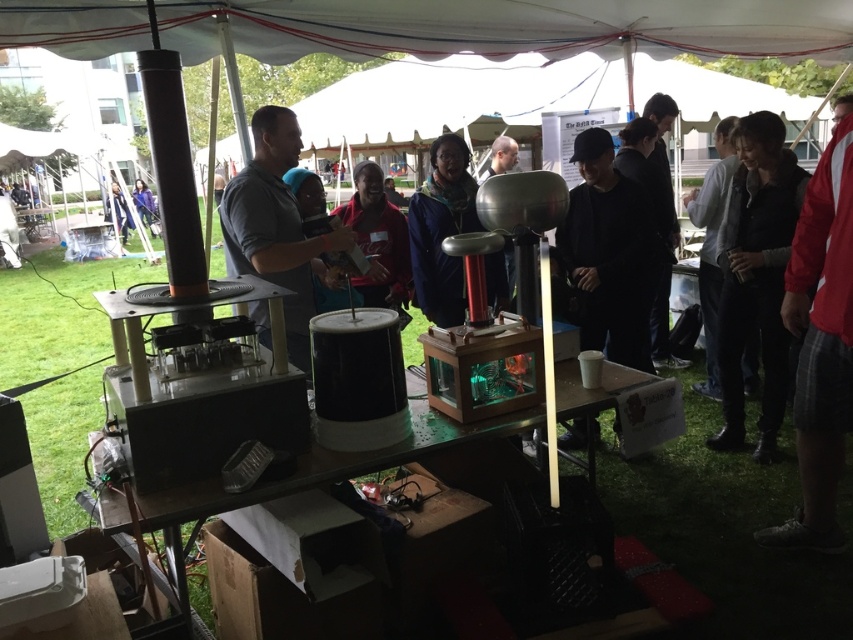
Is point (781, 250) closer to camera compared to point (376, 241)?

Yes, it is.

Image resolution: width=853 pixels, height=640 pixels. Identify the location of black leather jacket at right. (756, 276).

Is point (755, 301) more distant than point (370, 250)?

No, it is not.

Find the location of a particular element. This screenshot has width=853, height=640. black leather jacket at right is located at coordinates (756, 276).

Between gray matte shirt at center and light gray sweater at center, which one is positioned lower?

gray matte shirt at center is below.

Looking at this image, does gray matte shirt at center have a smaller size compared to light gray sweater at center?

Correct, gray matte shirt at center occupies less space than light gray sweater at center.

Between point (242, 225) and point (717, 186), which one is positioned in front?

Positioned in front is point (242, 225).

Identify the location of gray matte shirt at center. The image size is (853, 640). (276, 227).

Which is behind, point (566, 384) or point (142, 180)?

The point (142, 180) is more distant.

Is point (137, 556) closer to camera compared to point (146, 196)?

Yes, point (137, 556) is closer to viewer.

Which is behind, point (311, 472) or point (141, 204)?

Positioned behind is point (141, 204).

Identify the location of translucent plastic table at center. (207, 506).